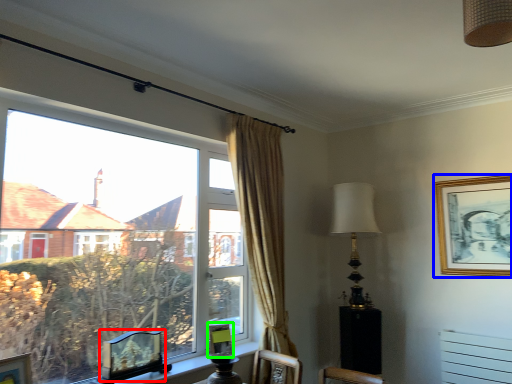
Question: Based on their relative distances, which object is nearer to picture frame (highlighted by a red box)? Choose from picture frame (highlighted by a blue box) and picture frame (highlighted by a green box).

Choices:
 (A) picture frame
 (B) picture frame

Answer: (B)